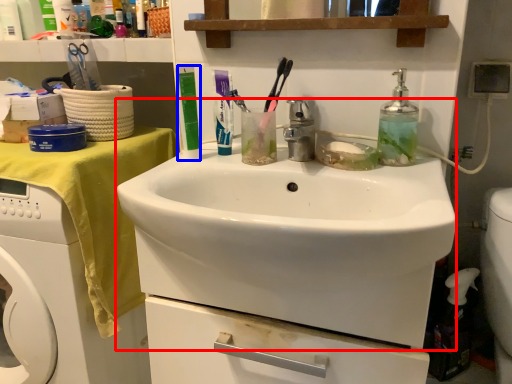
Question: Which point is closer to the camera, sink (highlighted by a red box) or toiletry (highlighted by a blue box)?

Choices:
 (A) sink
 (B) toiletry

Answer: (A)